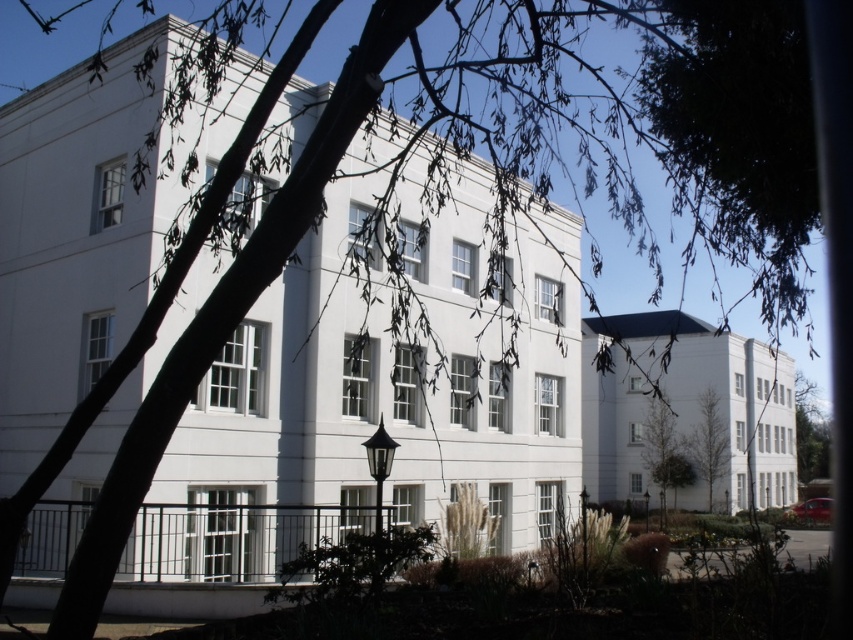
You are standing in front of the building and notice a point marked at coordinates (663, 451). Which object does this point correspond to?

The point at coordinates (663, 451) corresponds to the green leafy tree at lower right.

You are standing in front of the building and want to take a photo of the entire facade without any obstructions. Given the location of the green leafy tree at lower right, where should you move to ensure the tree is not blocking your view?

To avoid the green leafy tree at lower right, which is located at point [663,451], you should move to the left side of the building to ensure the tree does not obstruct your view of the facade.